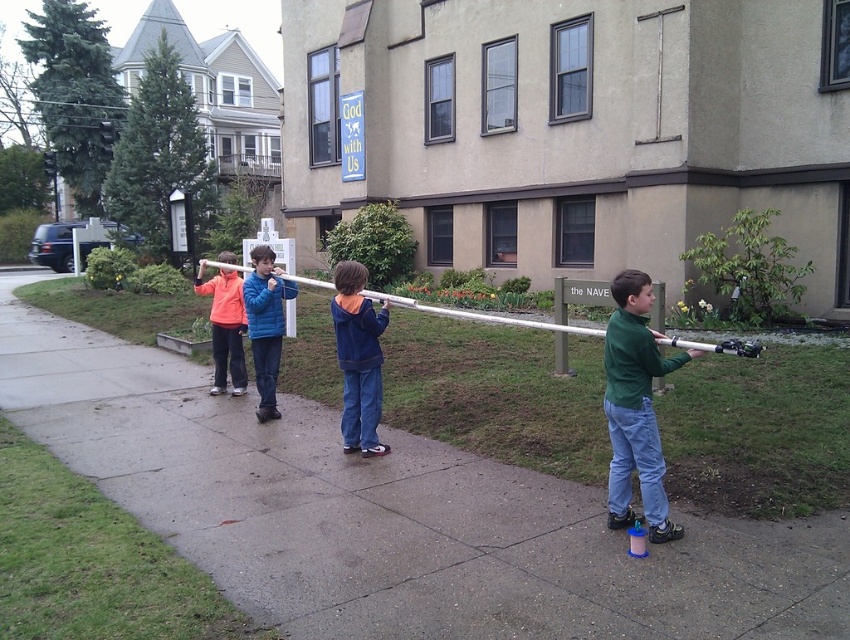
You are a photographer trying to capture a photo of the blue fleece jacket at center and the orange fleece jacket at left. If you want to ensure both jackets are fully visible in the frame, which jacket should you focus on first?

You should focus on the blue fleece jacket at center first because it is in front of the orange fleece jacket at left, ensuring both will be in focus if you prioritize the closer subject.